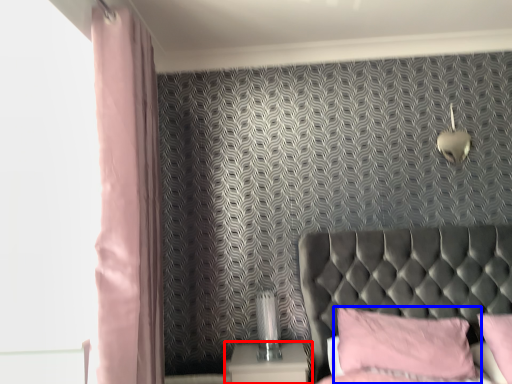
Question: Which object is closer to the camera taking this photo, nightstand (highlighted by a red box) or pillow (highlighted by a blue box)?

Choices:
 (A) nightstand
 (B) pillow

Answer: (B)